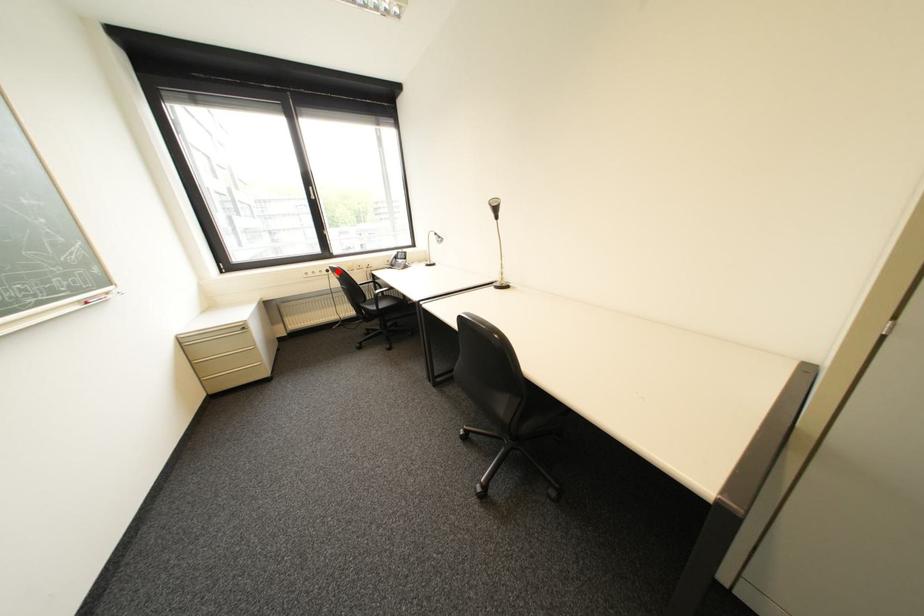
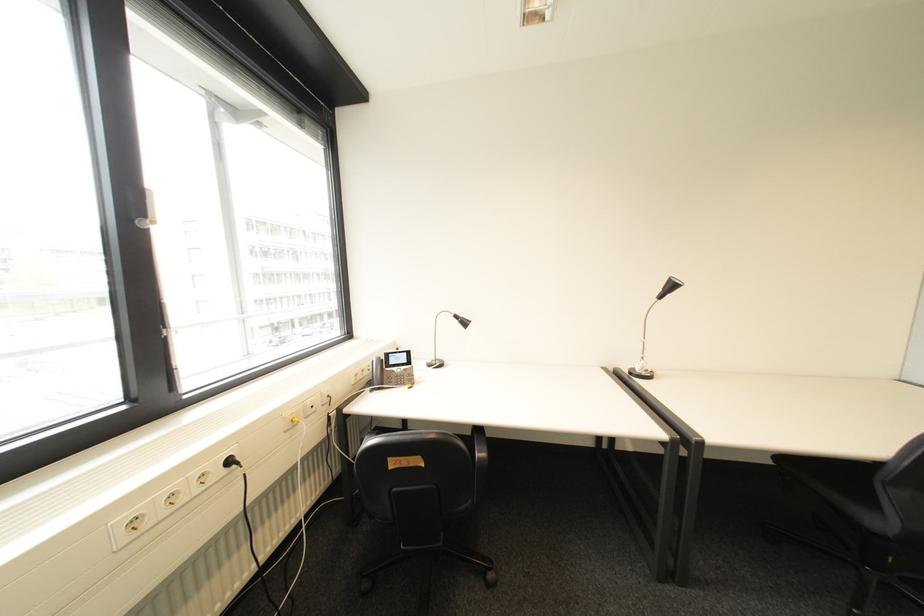
Find the pixel in the second image that matches the highlighted location in the first image.

(239, 463)